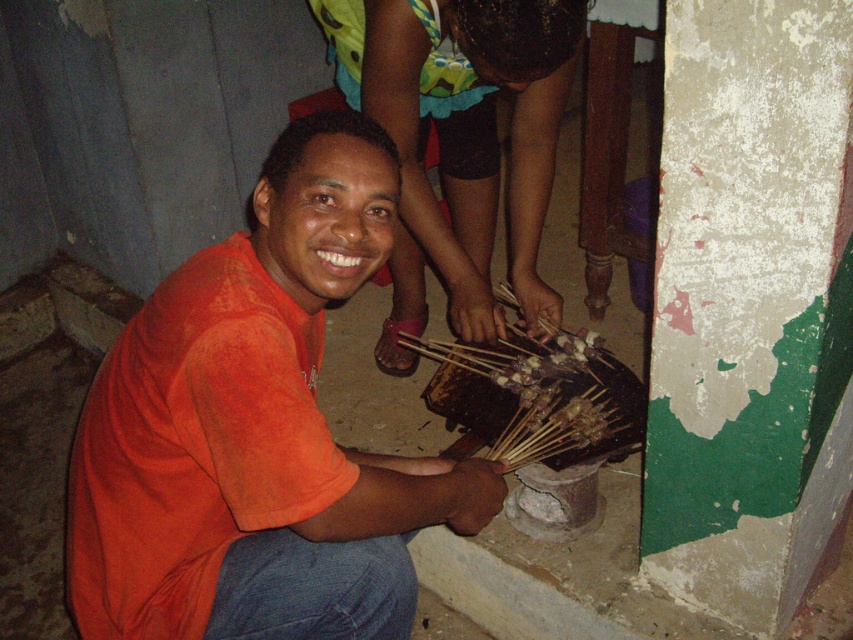
Question: Can you confirm if orange cotton shirt at center is bigger than orange matte shirt at center?

Choices:
 (A) yes
 (B) no

Answer: (B)

Question: Which of the following is the closest to the observer?

Choices:
 (A) orange matte shirt at center
 (B) orange cotton shirt at center

Answer: (B)

Question: Can you confirm if orange cotton shirt at center is bigger than orange matte shirt at center?

Choices:
 (A) yes
 (B) no

Answer: (B)

Question: Which point appears closest to the camera in this image?

Choices:
 (A) (218, 515)
 (B) (561, 28)

Answer: (A)

Question: Can you confirm if orange cotton shirt at center is wider than orange matte shirt at center?

Choices:
 (A) no
 (B) yes

Answer: (B)